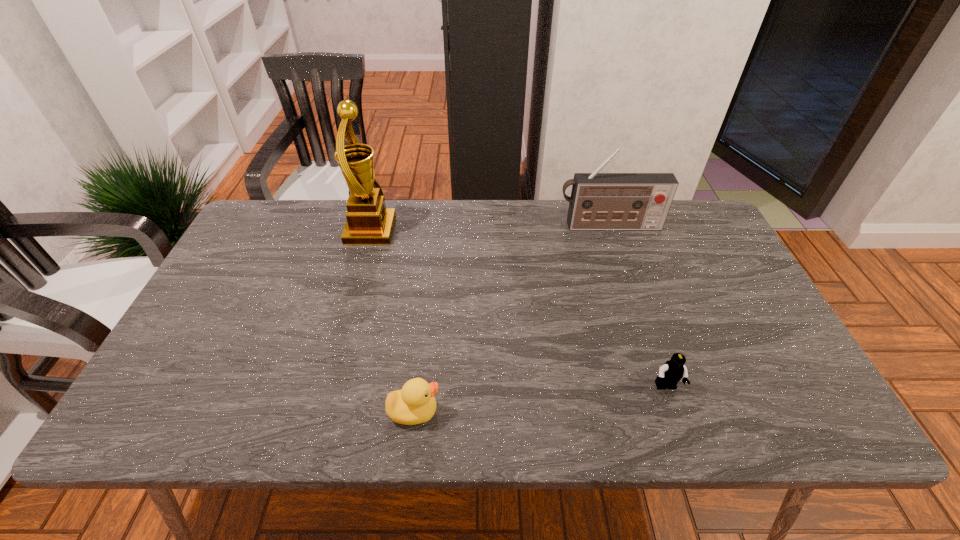
The width and height of the screenshot is (960, 540). Identify the location of the leftmost object. (369, 222).

This screenshot has width=960, height=540. I want to click on award, so click(369, 222).

Find the location of `radio receiver`. radio receiver is located at coordinates (599, 201).

This screenshot has width=960, height=540. I want to click on Lego, so click(x=670, y=373).

Image resolution: width=960 pixels, height=540 pixels. What are the coordinates of `duck` in the screenshot? It's located at [415, 403].

Where is `vacant area situated on the front-facing side of the leftmost object`? vacant area situated on the front-facing side of the leftmost object is located at coordinates (410, 231).

Locate an element on the screen. vacant area situated 0.380m on the front panel of the radio receiver is located at coordinates (643, 329).

Find the location of a particular element. The height and width of the screenshot is (540, 960). vacant space situated on the front-facing side of the Lego is located at coordinates (676, 416).

Image resolution: width=960 pixels, height=540 pixels. I want to click on free region located 0.380m at the beak of the duck, so click(617, 411).

Find the location of `award positioned at the far edge`. award positioned at the far edge is located at coordinates pyautogui.click(x=369, y=222).